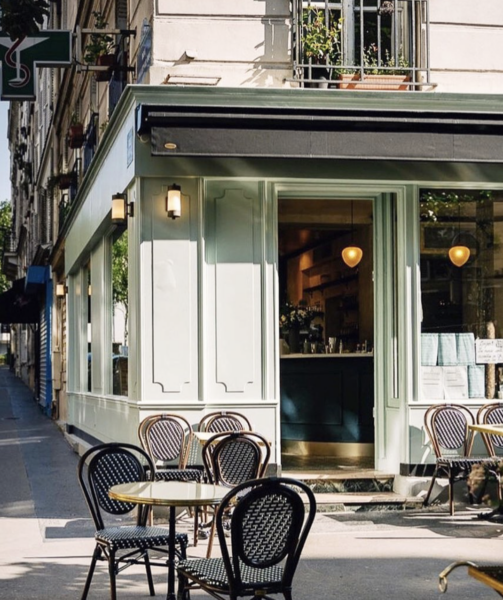
This screenshot has width=503, height=600. I want to click on chairs, so click(x=281, y=534), click(x=240, y=464), click(x=172, y=439), click(x=230, y=423), click(x=119, y=470), click(x=446, y=429), click(x=491, y=412).